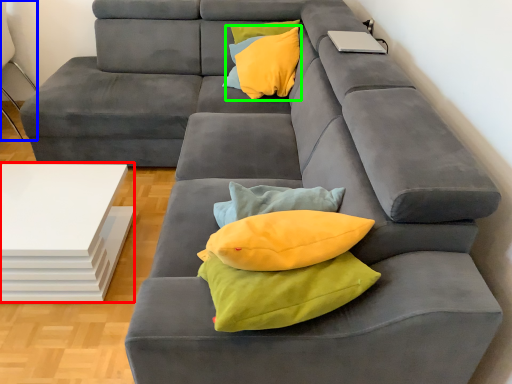
Question: Estimate the real-world distances between objects in this image. Which object is closer to table (highlighted by a red box), armchair (highlighted by a blue box) or throw pillow (highlighted by a green box)?

Choices:
 (A) armchair
 (B) throw pillow

Answer: (B)